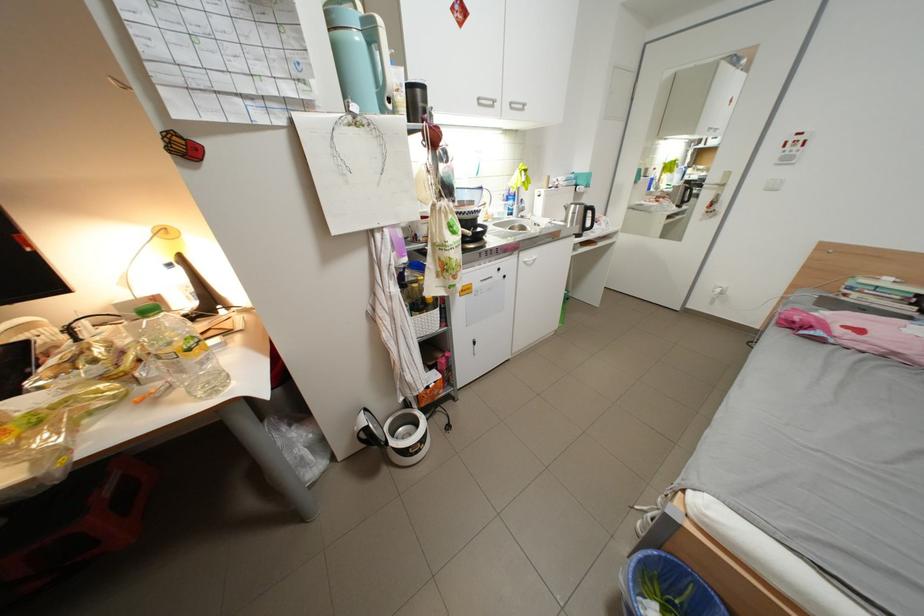
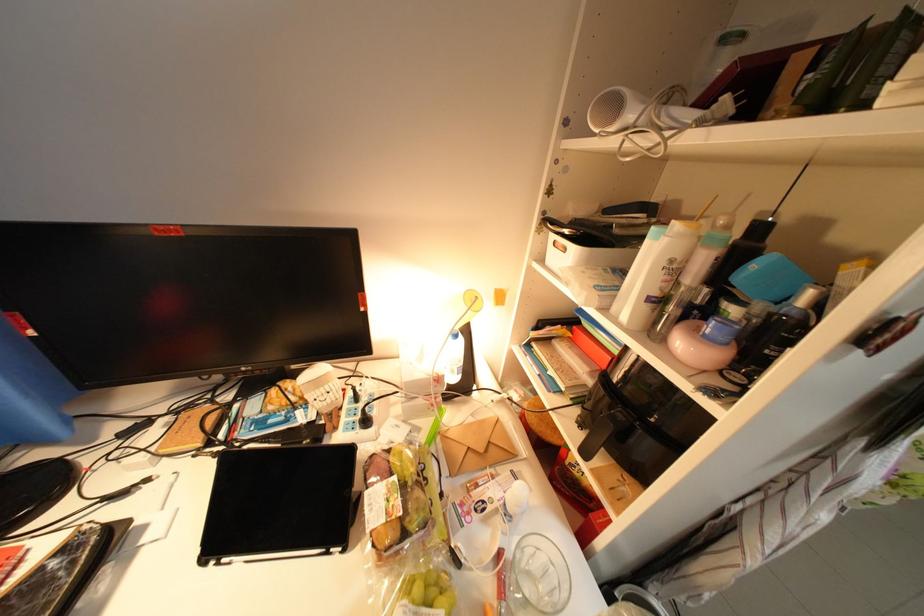
Question: I am providing you with two images of the same scene from different viewpoints. Which of the following objects are not visible in image2?

Choices:
 (A) black bottle pump
 (B) faucet handle
 (C) pink pipette tip box
 (D) white shampoo bottle

Answer: (B)